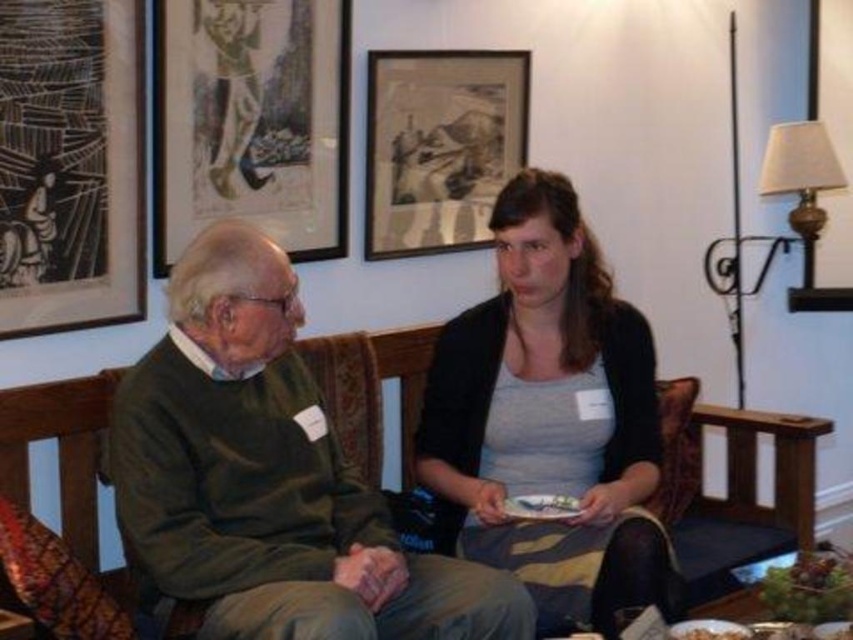
Question: Which point appears farthest from the camera in this image?

Choices:
 (A) (103, 74)
 (B) (669, 595)
 (C) (825, 138)
 (D) (195, 164)

Answer: (C)

Question: Among these objects, which one is farthest from the camera?

Choices:
 (A) white paper napkin at lower center
 (B) black paper picture frame at upper left
 (C) metallic gold lampshade at upper right

Answer: (C)

Question: Can you confirm if metallic gold lampshade at upper right is bigger than white paper napkin at lower center?

Choices:
 (A) no
 (B) yes

Answer: (B)

Question: Which of the following is the closest to the observer?

Choices:
 (A) gray cotton shirt at center
 (B) matte paper picture frame at upper center
 (C) black paper picture frame at upper left

Answer: (A)

Question: From the image, what is the correct spatial relationship of wooden framed artwork at upper center in relation to smooth brown bread at lower right?

Choices:
 (A) left
 (B) right

Answer: (A)

Question: Is black paper picture frame at upper left below white paper napkin at lower center?

Choices:
 (A) yes
 (B) no

Answer: (B)